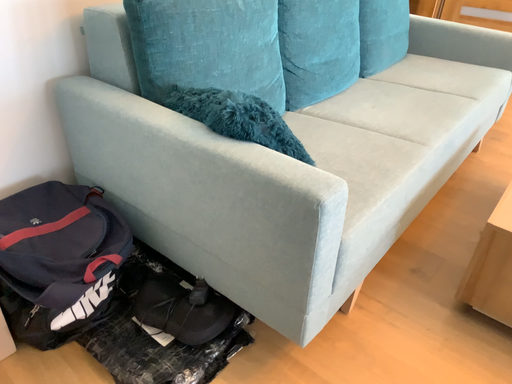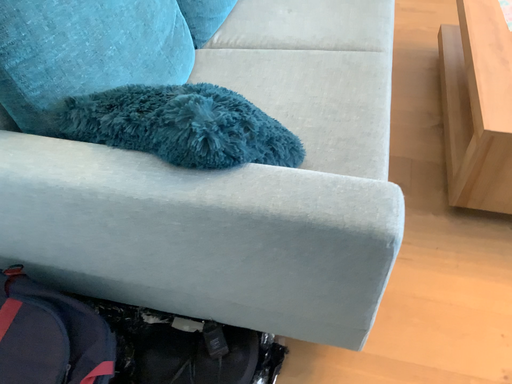
Question: Which way did the camera rotate in the video?

Choices:
 (A) rotated upward
 (B) rotated downward

Answer: (B)